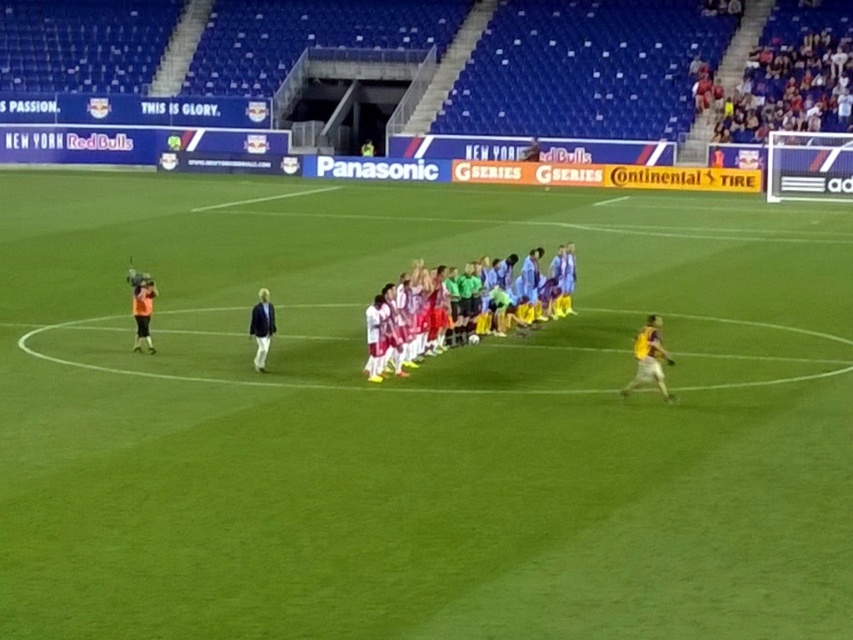
Question: Can you confirm if green grass field at center is smaller than dark blue jacket at center?

Choices:
 (A) no
 (B) yes

Answer: (A)

Question: Which is farther from the yellow jersey at right?

Choices:
 (A) white jersey at center
 (B) dark blue jacket at center
 (C) green grass field at center

Answer: (C)

Question: Which object is positioned farthest from the green grass field at center?

Choices:
 (A) yellow jersey at right
 (B) dark blue jacket at center
 (C) white jersey at center

Answer: (B)

Question: Which point is farther to the camera?

Choices:
 (A) dark blue jacket at center
 (B) yellow jersey at right
 (C) white jersey at center
 (D) green grass field at center

Answer: (C)

Question: Does green grass field at center appear on the right side of white jersey at center?

Choices:
 (A) no
 (B) yes

Answer: (A)

Question: Can you confirm if green grass field at center is thinner than white jersey at center?

Choices:
 (A) yes
 (B) no

Answer: (B)